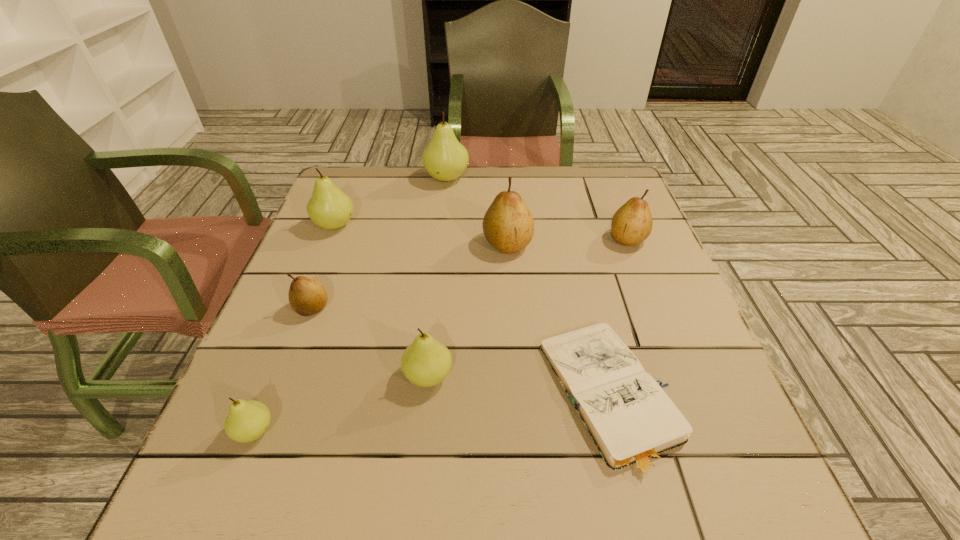
This screenshot has width=960, height=540. I want to click on vacant area that lies between the second brown pear from left to right and the shortest object, so click(559, 321).

Locate an element on the screen. object that stands as the seventh closest to the second nearest pear is located at coordinates (444, 158).

Where is `object that is the sixth closest to the nearest pear`? This screenshot has width=960, height=540. object that is the sixth closest to the nearest pear is located at coordinates (444, 158).

The width and height of the screenshot is (960, 540). Find the location of `pear that can be found as the closest to the second nearest pear`. pear that can be found as the closest to the second nearest pear is located at coordinates (307, 296).

Select which pear is the closest to the third biggest green pear. Please provide its 2D coordinates. Your answer should be formatted as a tuple, i.e. [(x, y)], where the tuple contains the x and y coordinates of a point satisfying the conditions above.

[(307, 296)]

Locate an element on the screen. green pear identified as the closest to the third smallest green pear is located at coordinates (444, 158).

Identify the location of green pear that is the second closest to the nearest pear. This screenshot has height=540, width=960. (329, 208).

You are a GUI agent. You are given a task and a screenshot of the screen. Output one action in this format:
    pyautogui.click(x=<x>, y=<y>)
    Task: Click on the brown pear identified as the second closest to the shortest object
    The height and width of the screenshot is (540, 960).
    Given the screenshot: What is the action you would take?
    pyautogui.click(x=632, y=223)

Image resolution: width=960 pixels, height=540 pixels. What are the coordinates of `brown pear object that ranks as the closest to the second brown pear from left to right` in the screenshot? It's located at (632, 223).

Identify the location of vacant region that satisfies the following two spatial constraints: 1. on the back side of the second nearest pear; 2. on the right side of the rightmost brown pear. The height and width of the screenshot is (540, 960). (443, 239).